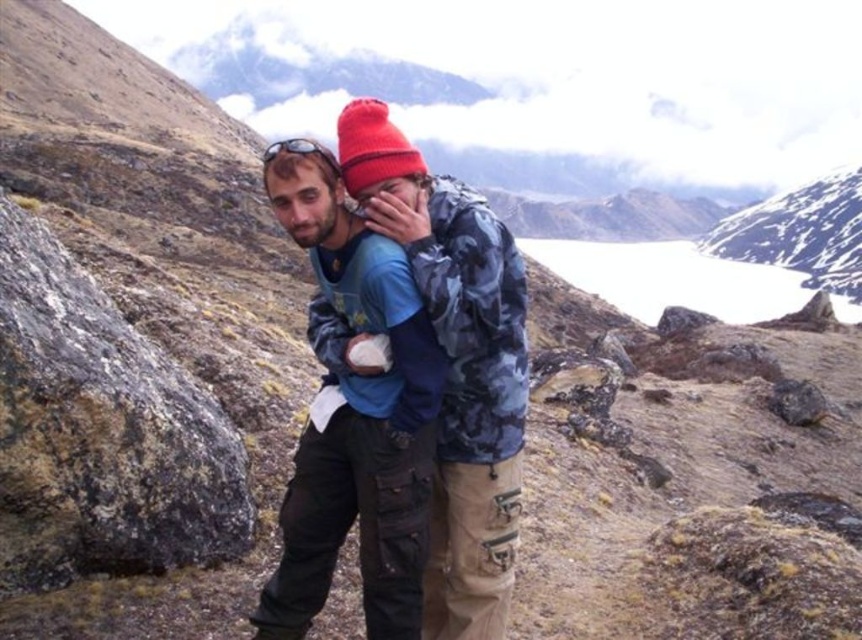
Question: Is matte blue shirt at center smaller than snowy white mountain at upper center?

Choices:
 (A) no
 (B) yes

Answer: (B)

Question: Estimate the real-world distances between objects in this image. Which object is farther from the rocky gray at left?

Choices:
 (A) snowy white mountain at upper center
 (B) camouflage jacket at center
 (C) matte blue shirt at center

Answer: (A)

Question: Can you confirm if rocky gray at left is smaller than snowy white mountain at upper center?

Choices:
 (A) yes
 (B) no

Answer: (A)

Question: Does camouflage jacket at center have a smaller size compared to snowy white mountain at upper center?

Choices:
 (A) no
 (B) yes

Answer: (B)

Question: Which of these objects is positioned farthest from the camouflage jacket at center?

Choices:
 (A) snowy white mountain at upper center
 (B) matte blue shirt at center
 (C) rocky gray at left

Answer: (A)

Question: Which object is closer to the camera taking this photo?

Choices:
 (A) matte blue shirt at center
 (B) camouflage jacket at center
 (C) snowy white mountain at upper center
 (D) rocky gray at left

Answer: (D)